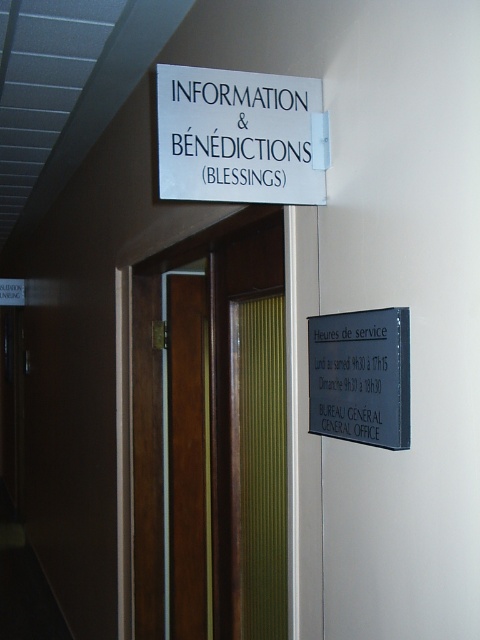
Is white plastic sign at upper center shorter than metallic gray sign at right?

No.

Between white plastic sign at upper center and metallic gray sign at right, which one is positioned higher?

white plastic sign at upper center

Is point (278, 77) farther from camera compared to point (334, 317)?

Yes.

Find the location of a particular element. The image size is (480, 640). white plastic sign at upper center is located at coordinates (240, 136).

Can you confirm if brown wood door at center is positioned to the right of metallic gray sign at right?

Incorrect, brown wood door at center is not on the right side of metallic gray sign at right.

You are a GUI agent. You are given a task and a screenshot of the screen. Output one action in this format:
    pyautogui.click(x=<x>, y=<y>)
    Task: Click on the brown wood door at center
    This screenshot has width=480, height=640.
    Given the screenshot: What is the action you would take?
    pyautogui.click(x=210, y=396)

Can you confirm if brown wood door at center is wider than white plastic sign at upper center?

Yes.

Between brown wood door at center and white plastic sign at upper center, which one has less height?

white plastic sign at upper center

Locate an element on the screen. brown wood door at center is located at coordinates (210, 396).